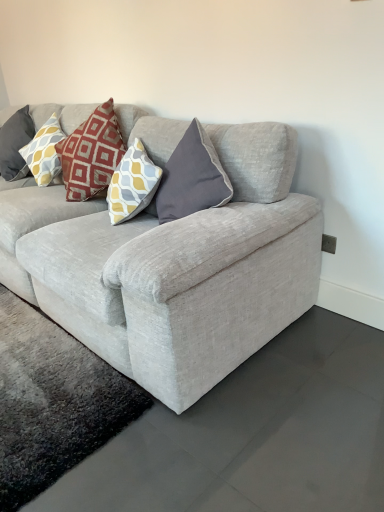
What is the approximate height of textured gray couch at center?

It is 35.19 inches.

What do you see at coordinates (173, 268) in the screenshot?
I see `textured gray couch at center` at bounding box center [173, 268].

You are a GUI agent. You are given a task and a screenshot of the screen. Output one action in this format:
    pyautogui.click(x=<x>, y=<y>)
    Task: Click on the textured gray couch at center
    
    Given the screenshot: What is the action you would take?
    pyautogui.click(x=173, y=268)

What is the approximate width of yellow and gray patterned pillow at upper left?

13.87 inches.

Describe the element at coordinates (44, 152) in the screenshot. I see `yellow and gray patterned pillow at upper left` at that location.

Locate an element on the screen. The image size is (384, 512). yellow and gray patterned pillow at upper left is located at coordinates (44, 152).

Measure the distance between point (50, 136) and camera.

Point (50, 136) and camera are 2.62 meters apart.

Where is `textured gray couch at center`? Image resolution: width=384 pixels, height=512 pixels. textured gray couch at center is located at coordinates (173, 268).

Based on the photo, can you confirm if yellow and gray patterned pillow at upper left is positioned to the left of textured gray couch at center?

Yes.

Which object is further away from the camera, yellow and gray patterned pillow at upper left or textured gray couch at center?

yellow and gray patterned pillow at upper left is more distant.

Which is in front, point (59, 132) or point (98, 300)?

Point (98, 300)

From the image's perspective, between yellow and gray patterned pillow at upper left and textured gray couch at center, which one is located above?

yellow and gray patterned pillow at upper left appears higher in the image.

From a real-world perspective, does yellow and gray patterned pillow at upper left sit lower than textured gray couch at center?

No.

Is yellow and gray patterned pillow at upper left wider or thinner than textured gray couch at center?

Considering their sizes, yellow and gray patterned pillow at upper left looks slimmer than textured gray couch at center.

Considering the sizes of objects yellow and gray patterned pillow at upper left and textured gray couch at center in the image provided, who is shorter, yellow and gray patterned pillow at upper left or textured gray couch at center?

yellow and gray patterned pillow at upper left is shorter.

Between yellow and gray patterned pillow at upper left and textured gray couch at center, which one has larger size?

Bigger between the two is textured gray couch at center.

Can we say yellow and gray patterned pillow at upper left lies outside textured gray couch at center?

No, most part of yellow and gray patterned pillow at upper left lies within textured gray couch at center.

Is yellow and gray patterned pillow at upper left not near textured gray couch at center?

Absolutely, yellow and gray patterned pillow at upper left is distant from textured gray couch at center.

Is yellow and gray patterned pillow at upper left positioned with its back to textured gray couch at center?

Yes, yellow and gray patterned pillow at upper left's orientation is away from textured gray couch at center.

What's the angular difference between yellow and gray patterned pillow at upper left and textured gray couch at center's facing directions?

The facing directions of yellow and gray patterned pillow at upper left and textured gray couch at center are 0.0489 degrees apart.

Where is `studio couch to the right of yellow and gray patterned pillow at upper left`? This screenshot has width=384, height=512. studio couch to the right of yellow and gray patterned pillow at upper left is located at coordinates (173, 268).

Considering the relative positions of textured gray couch at center and yellow and gray patterned pillow at upper left in the image provided, is textured gray couch at center to the right of yellow and gray patterned pillow at upper left from the viewer's perspective?

Yes, textured gray couch at center is to the right of yellow and gray patterned pillow at upper left.

Considering their positions, is textured gray couch at center located in front of or behind yellow and gray patterned pillow at upper left?

textured gray couch at center is positioned closer to the viewer than yellow and gray patterned pillow at upper left.

Is point (257, 289) closer to viewer compared to point (57, 138)?

Yes, point (257, 289) is closer to viewer.

From the image's perspective, who appears lower, textured gray couch at center or yellow and gray patterned pillow at upper left?

textured gray couch at center, from the image's perspective.

From a real-world perspective, is textured gray couch at center positioned above or below yellow and gray patterned pillow at upper left?

In terms of real-world spatial position, textured gray couch at center is below yellow and gray patterned pillow at upper left.

Considering the relative sizes of textured gray couch at center and yellow and gray patterned pillow at upper left in the image provided, is textured gray couch at center thinner than yellow and gray patterned pillow at upper left?

No, textured gray couch at center is not thinner than yellow and gray patterned pillow at upper left.

Is textured gray couch at center shorter than yellow and gray patterned pillow at upper left?

No, textured gray couch at center is not shorter than yellow and gray patterned pillow at upper left.

In the scene shown: Is textured gray couch at center bigger than yellow and gray patterned pillow at upper left?

Yes.

Is textured gray couch at center completely or partially outside of yellow and gray patterned pillow at upper left?

That's correct, textured gray couch at center is outside of yellow and gray patterned pillow at upper left.

Is textured gray couch at center not near yellow and gray patterned pillow at upper left?

textured gray couch at center is far away from yellow and gray patterned pillow at upper left.

Could you tell me if textured gray couch at center is facing yellow and gray patterned pillow at upper left?

Yes, textured gray couch at center is oriented towards yellow and gray patterned pillow at upper left.

Locate an element on the screen. studio couch below the yellow and gray patterned pillow at upper left (from a real-world perspective) is located at coordinates (173, 268).

Locate an element on the screen. This screenshot has width=384, height=512. pillow behind the textured gray couch at center is located at coordinates 44,152.

You are a GUI agent. You are given a task and a screenshot of the screen. Output one action in this format:
    pyautogui.click(x=<x>, y=<y>)
    Task: Click on the pillow on the left of textured gray couch at center
    This screenshot has width=384, height=512.
    Given the screenshot: What is the action you would take?
    pyautogui.click(x=44, y=152)